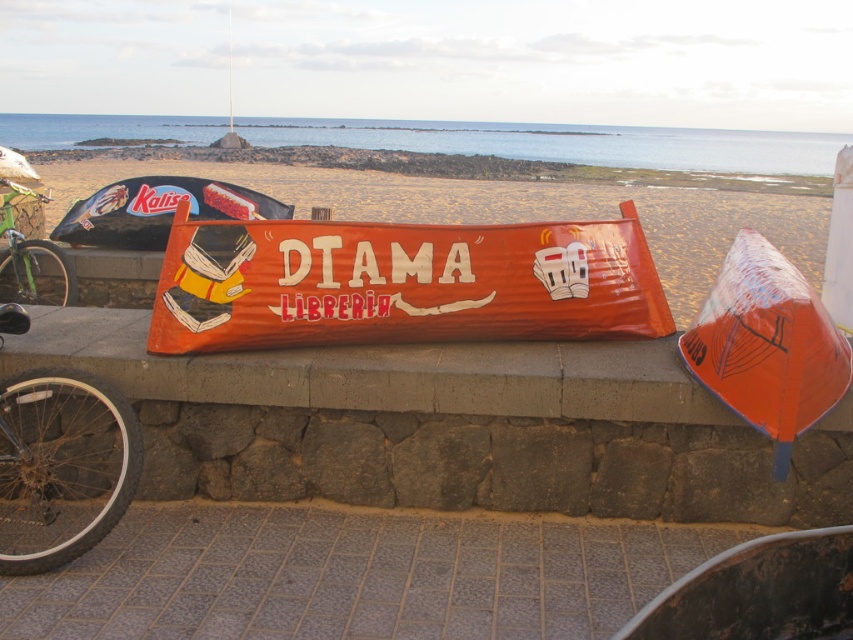
Question: Is orange corrugated sign at center below concrete ledge at center?

Choices:
 (A) yes
 (B) no

Answer: (B)

Question: From the image, what is the correct spatial relationship of concrete ledge at center in relation to silver metallic bicycle wheel at lower left?

Choices:
 (A) right
 (B) left

Answer: (A)

Question: Which point is farther to the camera?

Choices:
 (A) (387, 381)
 (B) (714, 241)
 (C) (111, 426)
 (D) (30, 262)

Answer: (B)

Question: Which of these objects is positioned closest to the green matte bicycle at left?

Choices:
 (A) concrete ledge at center
 (B) orange corrugated cardboard sign at center
 (C) orange corrugated sign at center

Answer: (A)

Question: In this image, where is concrete ledge at center located relative to green matte bicycle at left?

Choices:
 (A) above
 (B) below

Answer: (B)

Question: Which object is positioned farthest from the orange corrugated sign at center?

Choices:
 (A) concrete ledge at center
 (B) orange corrugated cardboard sign at center

Answer: (A)